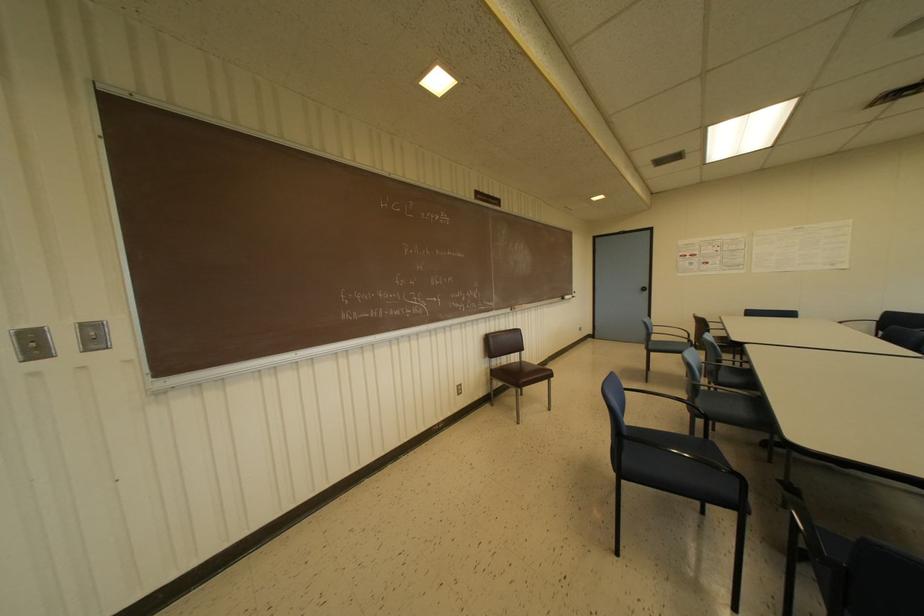
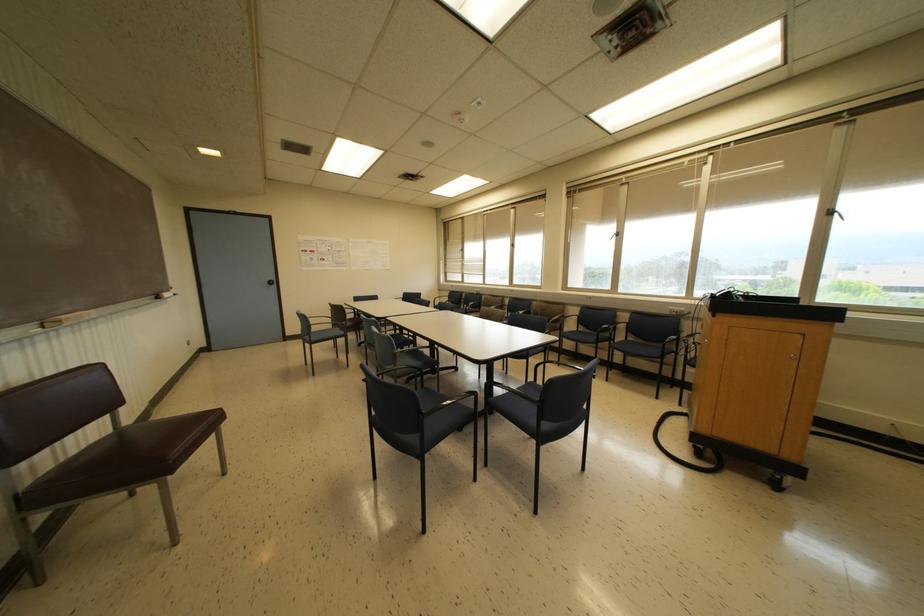
Find the pixel in the second image that matches point 519,362 in the first image.

(118, 430)